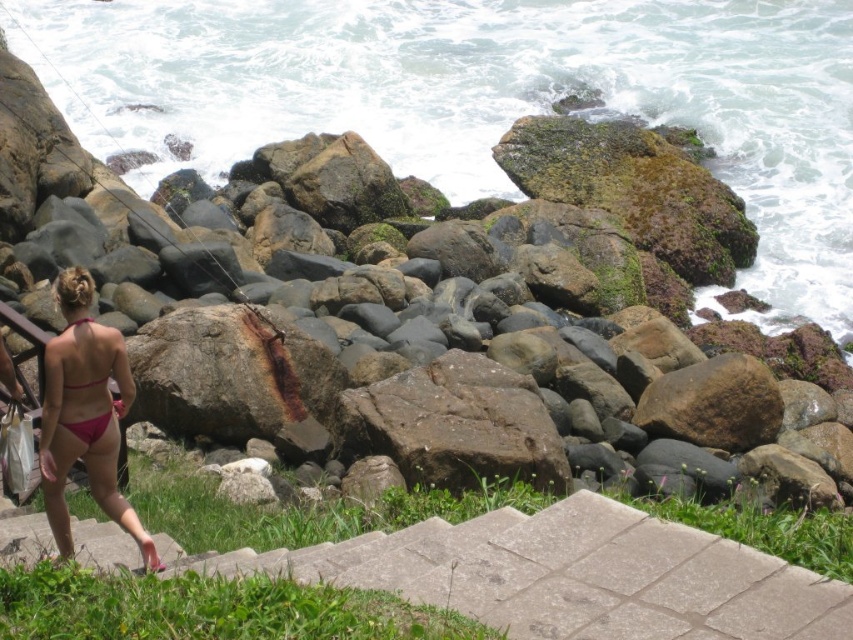
You are a hiker who wants to take a photo of the rusty metal rock at center and the concrete steps at lower center. Which object should you stand closer to in order to capture both in the same frame without zooming in?

The rusty metal rock at center is much taller than the concrete steps at lower center, so you should stand closer to the concrete steps at lower center to include both in the frame without zooming.

You are a photographer standing on the paved pathway and see the pink fabric bikini at lower left and the pink matte bikini at lower left. Which one is higher up?

The pink fabric bikini at lower left is above the pink matte bikini at lower left, so it is higher up.